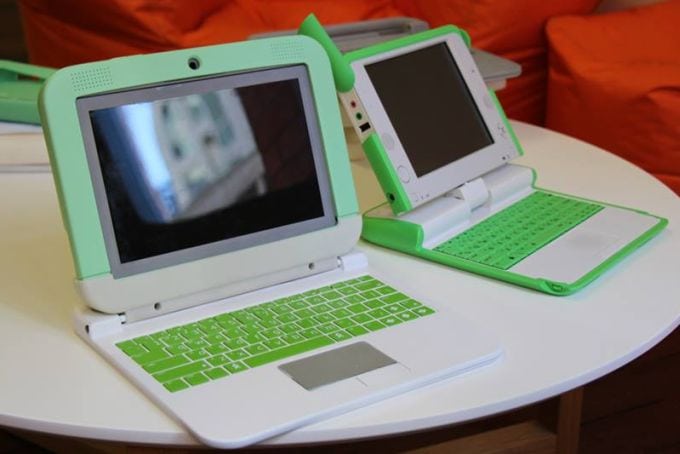
The image size is (680, 454). Identify the location of grey mousepad. (341, 361).